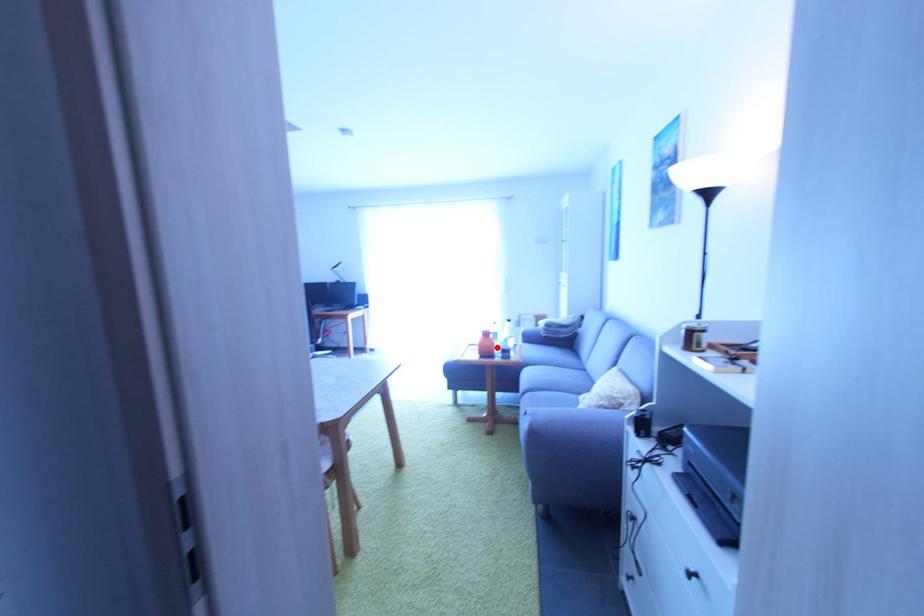
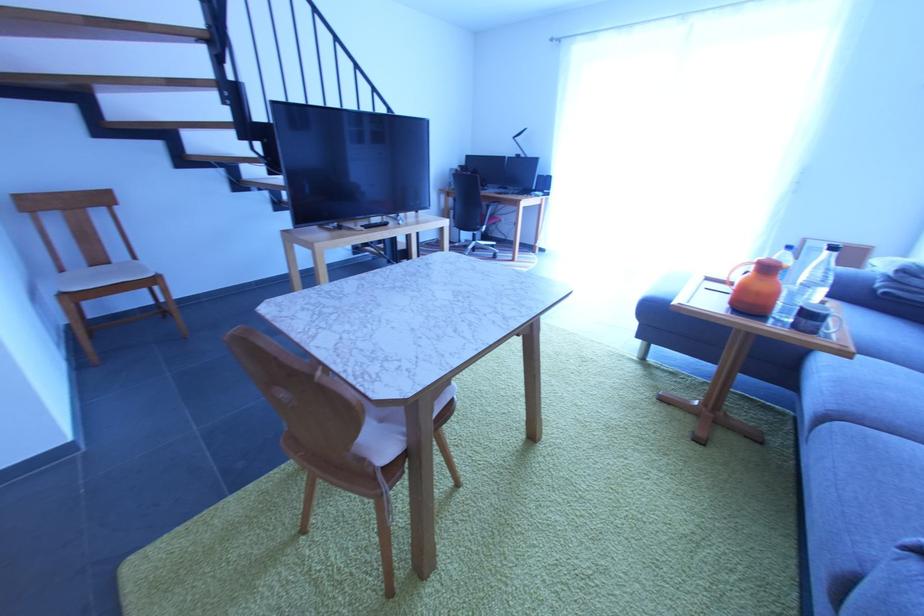
Question: I am providing you with two images of the same scene from different viewpoints. A red point is marked on the first image. At the location where the point appears in image 1, is it still visible in image 2?

Choices:
 (A) Yes
 (B) No

Answer: (A)